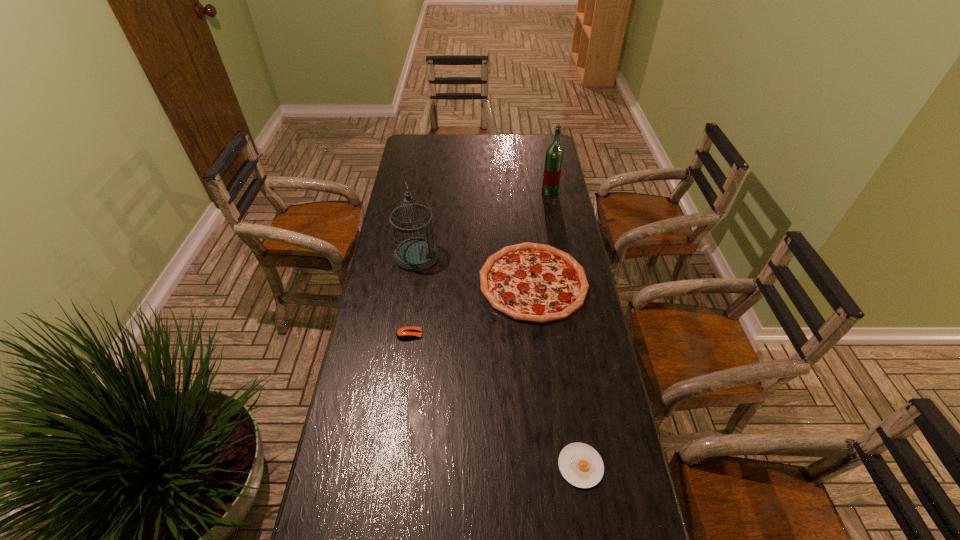
Find the location of a particular element. birdcage is located at coordinates (415, 254).

I want to click on the farthest object, so click(x=554, y=154).

The image size is (960, 540). Identify the location of the third shortest object. (531, 282).

Find the location of a particular element. The height and width of the screenshot is (540, 960). computer mouse is located at coordinates (405, 333).

Find the location of a particular element. the fourth farthest object is located at coordinates (405, 333).

Where is `the nearest object`? This screenshot has height=540, width=960. the nearest object is located at coordinates (581, 465).

The height and width of the screenshot is (540, 960). Find the location of `egg yolk`. egg yolk is located at coordinates (581, 465).

You are a GUI agent. You are given a task and a screenshot of the screen. Output one action in this format:
    pyautogui.click(x=<x>, y=<y>)
    Task: Click on the free space located 0.270m on the front-facing side of the birdcage
    This screenshot has width=960, height=540.
    Given the screenshot: What is the action you would take?
    pyautogui.click(x=511, y=256)

Where is `free region located on the back of the liquor`? This screenshot has width=960, height=540. free region located on the back of the liquor is located at coordinates (545, 168).

You are a GUI agent. You are given a task and a screenshot of the screen. Output one action in this format:
    pyautogui.click(x=<x>, y=<y>)
    Task: Click on the free space located 0.380m on the front of the pizza
    
    Given the screenshot: What is the action you would take?
    pyautogui.click(x=551, y=441)